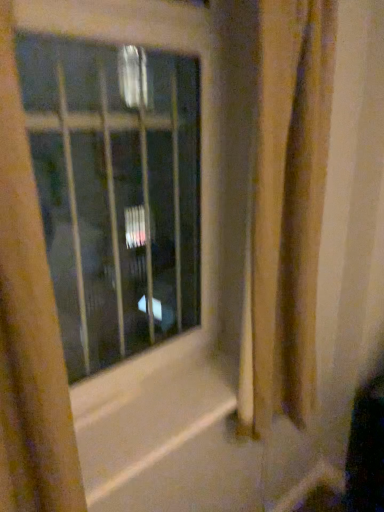
Find the location of `brown textured shower curtain at right`. brown textured shower curtain at right is located at coordinates (287, 210).

What do you see at coordinates (29, 327) in the screenshot?
I see `yellow textured curtain at left` at bounding box center [29, 327].

The height and width of the screenshot is (512, 384). What are the coordinates of `brown textured shower curtain at right` in the screenshot? It's located at [287, 210].

Is yellow textured curtain at left positioned with its back to brown textured shower curtain at right?

No, yellow textured curtain at left is not facing the opposite direction of brown textured shower curtain at right.

Would you say yellow textured curtain at left is a long distance from brown textured shower curtain at right?

No, yellow textured curtain at left is not far from brown textured shower curtain at right.

Considering the relative positions of yellow textured curtain at left and brown textured shower curtain at right in the image provided, is yellow textured curtain at left to the left or to the right of brown textured shower curtain at right?

yellow textured curtain at left is to the left of brown textured shower curtain at right.

From a real-world perspective, who is located lower, yellow textured curtain at left or brown textured shower curtain at right?

yellow textured curtain at left.

From the image's perspective, which one is positioned lower, yellow textured curtain at left or transparent glass window at center?

yellow textured curtain at left.

Considering the relative sizes of yellow textured curtain at left and transparent glass window at center in the image provided, is yellow textured curtain at left wider than transparent glass window at center?

Correct, the width of yellow textured curtain at left exceeds that of transparent glass window at center.

Does yellow textured curtain at left appear on the right side of transparent glass window at center?

No.

Based on the photo, does yellow textured curtain at left come behind transparent glass window at center?

No, it is in front of transparent glass window at center.

You are a GUI agent. You are given a task and a screenshot of the screen. Output one action in this format:
    pyautogui.click(x=<x>, y=<y>)
    Task: Click on the curtain in front of the brown textured shower curtain at right
    
    Given the screenshot: What is the action you would take?
    pyautogui.click(x=29, y=327)

From a real-world perspective, which is physically above, brown textured shower curtain at right or yellow textured curtain at left?

brown textured shower curtain at right is physically above.

Consider the image. Can you confirm if brown textured shower curtain at right is thinner than yellow textured curtain at left?

Yes, brown textured shower curtain at right is thinner than yellow textured curtain at left.

Is brown textured shower curtain at right oriented towards yellow textured curtain at left?

No, brown textured shower curtain at right is not oriented towards yellow textured curtain at left.

Considering the sizes of objects brown textured shower curtain at right and transparent glass window at center in the image provided, who is thinner, brown textured shower curtain at right or transparent glass window at center?

Thinner between the two is transparent glass window at center.

Is brown textured shower curtain at right situated inside transparent glass window at center or outside?

brown textured shower curtain at right is not enclosed by transparent glass window at center.

Is brown textured shower curtain at right next to transparent glass window at center and touching it?

No, brown textured shower curtain at right is not beside transparent glass window at center.

Is brown textured shower curtain at right oriented towards transparent glass window at center?

No, brown textured shower curtain at right is not facing towards transparent glass window at center.

From their relative heights in the image, would you say transparent glass window at center is taller or shorter than brown textured shower curtain at right?

transparent glass window at center is shorter than brown textured shower curtain at right.

In the image, is transparent glass window at center on the left side or the right side of brown textured shower curtain at right?

In the image, transparent glass window at center appears on the left side of brown textured shower curtain at right.

Is transparent glass window at center inside the boundaries of brown textured shower curtain at right, or outside?

transparent glass window at center cannot be found inside brown textured shower curtain at right.

Based on the photo, looking at the image, does transparent glass window at center seem bigger or smaller compared to yellow textured curtain at left?

transparent glass window at center is smaller than yellow textured curtain at left.

Based on the photo, choose the correct answer: Is transparent glass window at center inside yellow textured curtain at left or outside it?

transparent glass window at center exists outside the volume of yellow textured curtain at left.

From the image's perspective, is transparent glass window at center located above yellow textured curtain at left?

Yes, from the image's perspective, transparent glass window at center is over yellow textured curtain at left.

Considering the relative sizes of transparent glass window at center and yellow textured curtain at left in the image provided, is transparent glass window at center thinner than yellow textured curtain at left?

Correct, the width of transparent glass window at center is less than that of yellow textured curtain at left.

The image size is (384, 512). In the image, there is a brown textured shower curtain at right. What are the coordinates of `curtain below it (from the image's perspective)` in the screenshot? It's located at (29, 327).

Identify the location of window behind the yellow textured curtain at left. (115, 192).

Based on their spatial positions, is transparent glass window at center or yellow textured curtain at left further from brown textured shower curtain at right?

transparent glass window at center is positioned further to the anchor brown textured shower curtain at right.

Based on their spatial positions, is yellow textured curtain at left or brown textured shower curtain at right closer to transparent glass window at center?

Based on the image, brown textured shower curtain at right appears to be nearer to transparent glass window at center.

Looking at the image, which one is located closer to yellow textured curtain at left, brown textured shower curtain at right or transparent glass window at center?

brown textured shower curtain at right.

From the image, which object appears to be farther from brown textured shower curtain at right, yellow textured curtain at left or transparent glass window at center?

transparent glass window at center is positioned further to the anchor brown textured shower curtain at right.

Looking at the image, which one is located further to yellow textured curtain at left, transparent glass window at center or brown textured shower curtain at right?

transparent glass window at center is further to yellow textured curtain at left.

Estimate the real-world distances between objects in this image. Which object is closer to transparent glass window at center, brown textured shower curtain at right or yellow textured curtain at left?

brown textured shower curtain at right.

You are a GUI agent. You are given a task and a screenshot of the screen. Output one action in this format:
    pyautogui.click(x=<x>, y=<y>)
    Task: Click on the window between yellow textured curtain at left and brown textured shower curtain at right in the horizontal direction
    
    Given the screenshot: What is the action you would take?
    pyautogui.click(x=115, y=192)